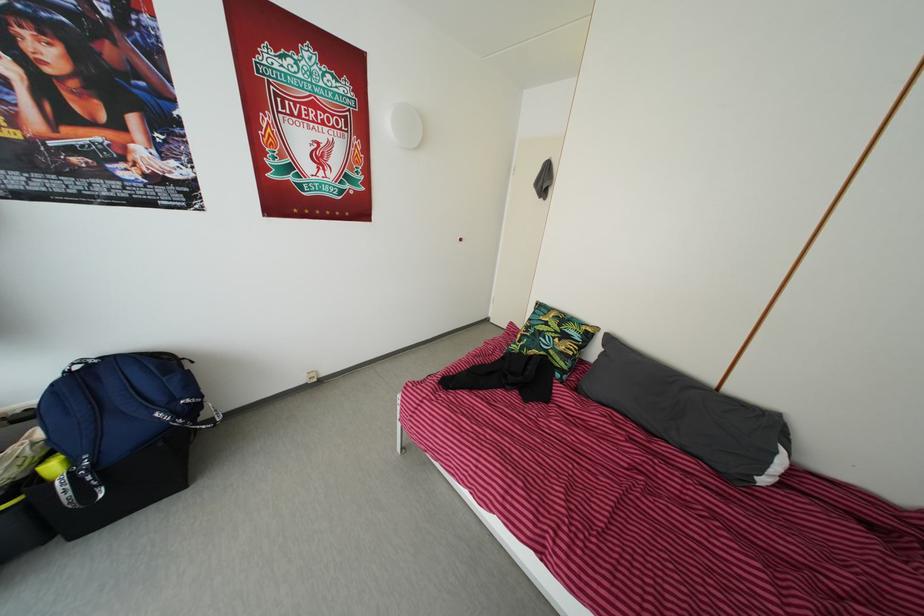
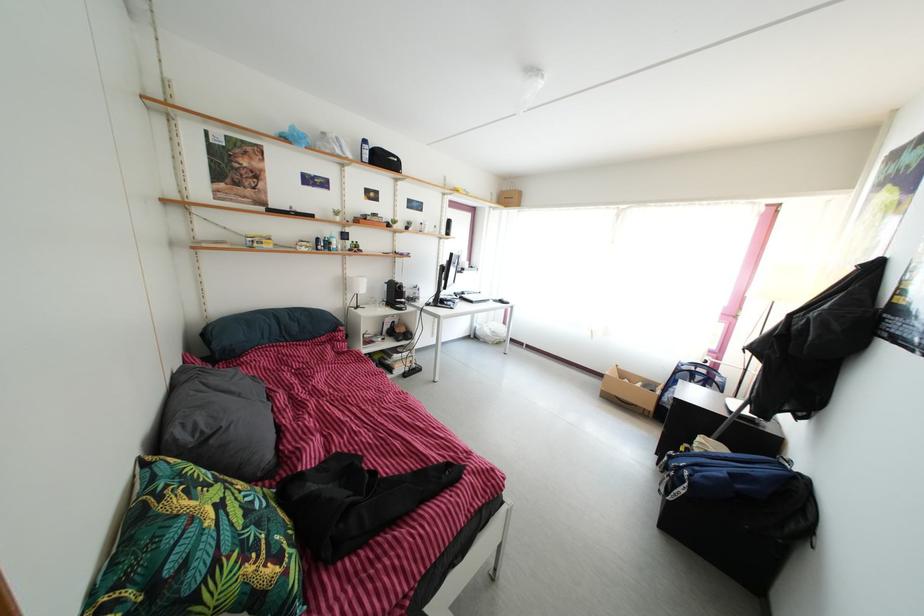
Locate, in the second image, the point that corresponds to (x=540, y=342) in the first image.

(264, 533)